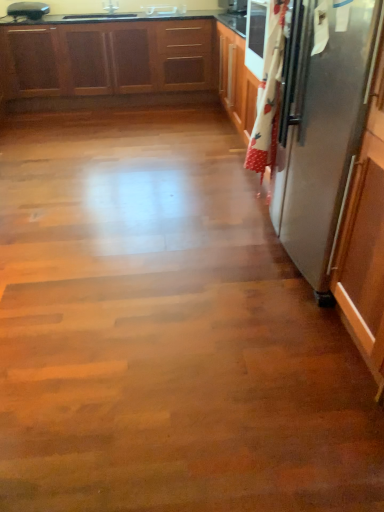
Question: From the image's perspective, would you say white glossy sink at upper center is positioned over metallic silver toaster at upper left?

Choices:
 (A) yes
 (B) no

Answer: (A)

Question: Would you say white glossy sink at upper center is outside metallic silver toaster at upper left?

Choices:
 (A) yes
 (B) no

Answer: (A)

Question: Is white glossy sink at upper center oriented towards metallic silver toaster at upper left?

Choices:
 (A) yes
 (B) no

Answer: (B)

Question: Is white glossy sink at upper center in front of metallic silver toaster at upper left?

Choices:
 (A) yes
 (B) no

Answer: (B)

Question: Is white glossy sink at upper center to the right of metallic silver toaster at upper left from the viewer's perspective?

Choices:
 (A) no
 (B) yes

Answer: (B)

Question: Is white glossy sink at upper center turned away from metallic silver toaster at upper left?

Choices:
 (A) yes
 (B) no

Answer: (B)

Question: Is the position of white glossy sink at upper center more distant than that of wooden cabinets at upper left?

Choices:
 (A) yes
 (B) no

Answer: (A)

Question: Can you confirm if white glossy sink at upper center is wider than wooden cabinets at upper left?

Choices:
 (A) yes
 (B) no

Answer: (B)

Question: Is white glossy sink at upper center completely or partially outside of wooden cabinets at upper left?

Choices:
 (A) no
 (B) yes

Answer: (B)

Question: Is white glossy sink at upper center bigger than wooden cabinets at upper left?

Choices:
 (A) yes
 (B) no

Answer: (B)

Question: From a real-world perspective, is white glossy sink at upper center under wooden cabinets at upper left?

Choices:
 (A) yes
 (B) no

Answer: (B)

Question: Is there a large distance between white glossy sink at upper center and wooden cabinets at upper left?

Choices:
 (A) no
 (B) yes

Answer: (A)

Question: Is metallic silver toaster at upper left to the right of wooden cabinets at upper left from the viewer's perspective?

Choices:
 (A) yes
 (B) no

Answer: (B)